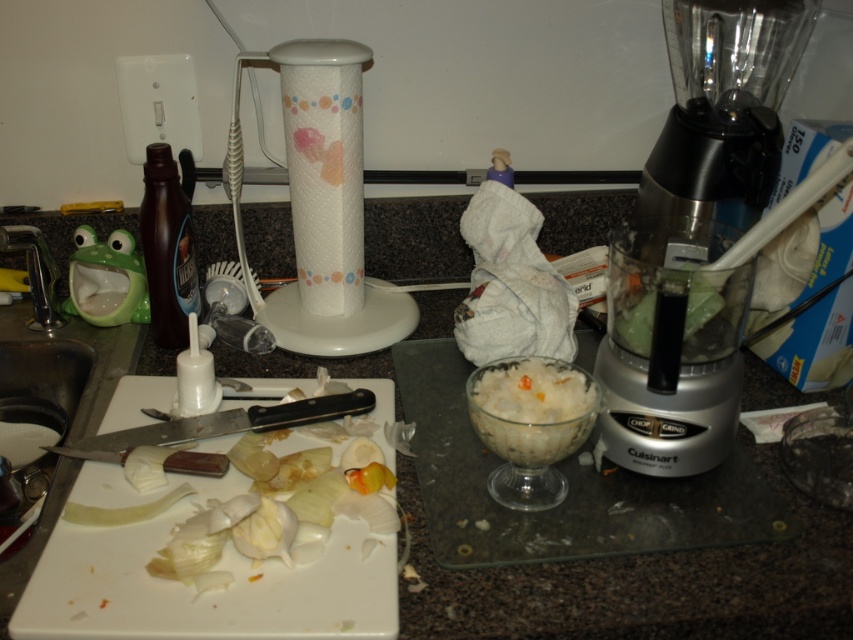
Looking at this image, can you confirm if white glossy paper towel holder at center is positioned above green leafy vegetable at center?

Correct, white glossy paper towel holder at center is located above green leafy vegetable at center.

Who is higher up, white glossy paper towel holder at center or green leafy vegetable at center?

white glossy paper towel holder at center is higher up.

Find the location of a particular element. Image resolution: width=853 pixels, height=640 pixels. white glossy paper towel holder at center is located at coordinates (320, 205).

Who is lower down, white glossy paper towel holder at center or white translucent bowl at center?

white translucent bowl at center is lower down.

What do you see at coordinates (320, 205) in the screenshot? The width and height of the screenshot is (853, 640). I see `white glossy paper towel holder at center` at bounding box center [320, 205].

Is point (345, 346) closer to camera compared to point (573, 403)?

No, (345, 346) is further to viewer.

You are a GUI agent. You are given a task and a screenshot of the screen. Output one action in this format:
    pyautogui.click(x=<x>, y=<y>)
    Task: Click on the white glossy paper towel holder at center
    The image size is (853, 640).
    Given the screenshot: What is the action you would take?
    pyautogui.click(x=320, y=205)

Is point (67, 572) positioned after point (357, 44)?

No.

Does white plastic cutting board at lower left lie behind white glossy paper towel holder at center?

No, it is not.

Does point (123, 490) lie in front of point (349, 186)?

Yes.

This screenshot has width=853, height=640. What are the coordinates of `white plastic cutting board at lower left` in the screenshot? It's located at (193, 586).